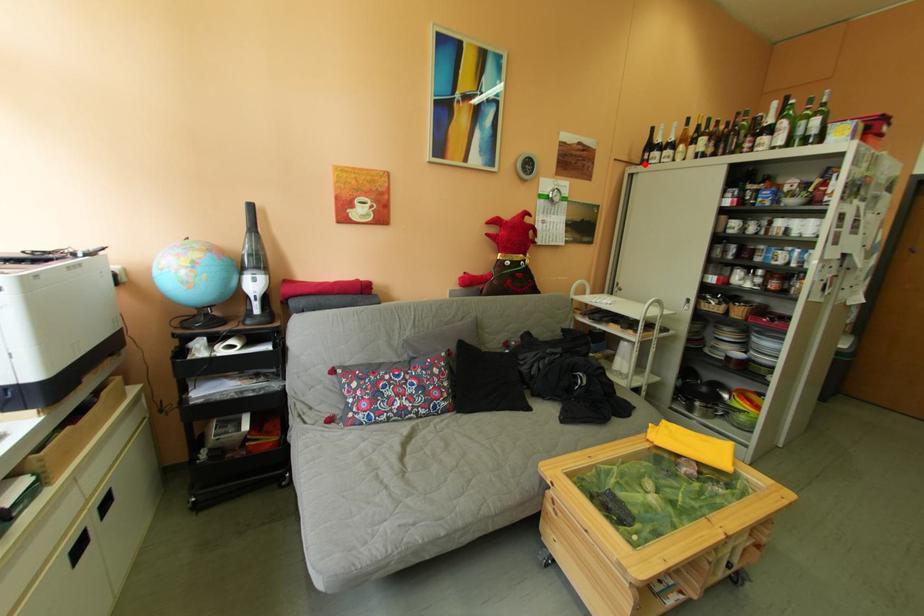
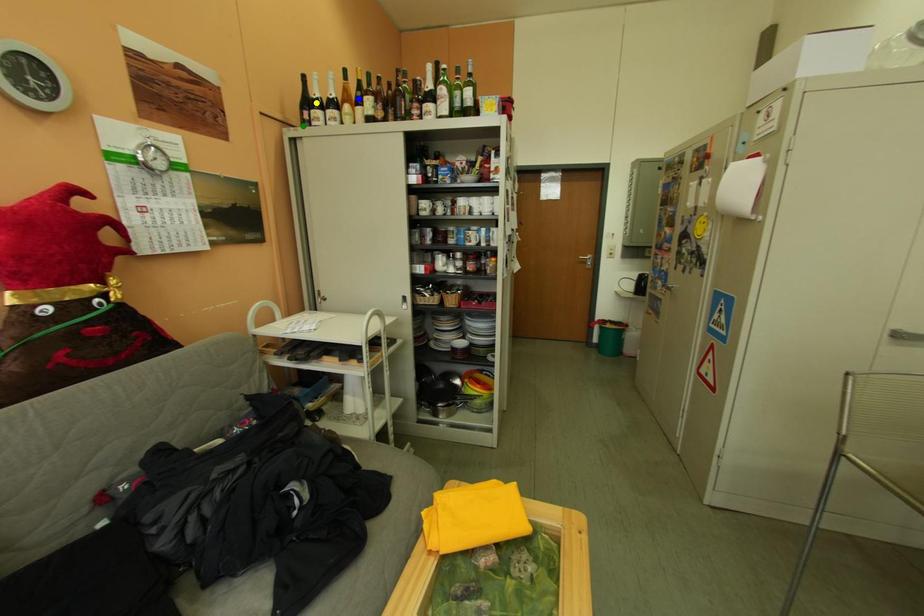
Question: I am providing you with two images of the same scene from different viewpoints. A red point is marked on the first image. You are given multiple points on the second image. Which spot in image 2 lines up with the point in image 1?

Choices:
 (A) green point
 (B) yellow point
 (C) blue point

Answer: (A)